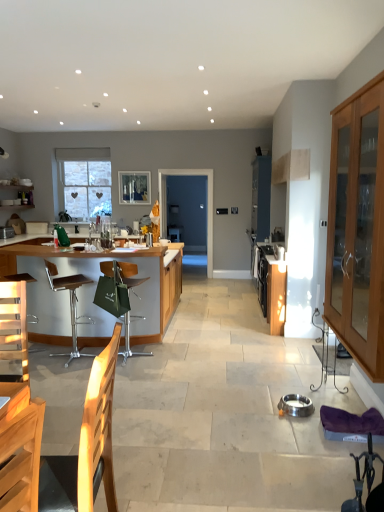
Image resolution: width=384 pixels, height=512 pixels. What are the coordinates of `free spot to the left of silver metallic bowl at center, the 2th appliance from the left` in the screenshot? It's located at (260, 408).